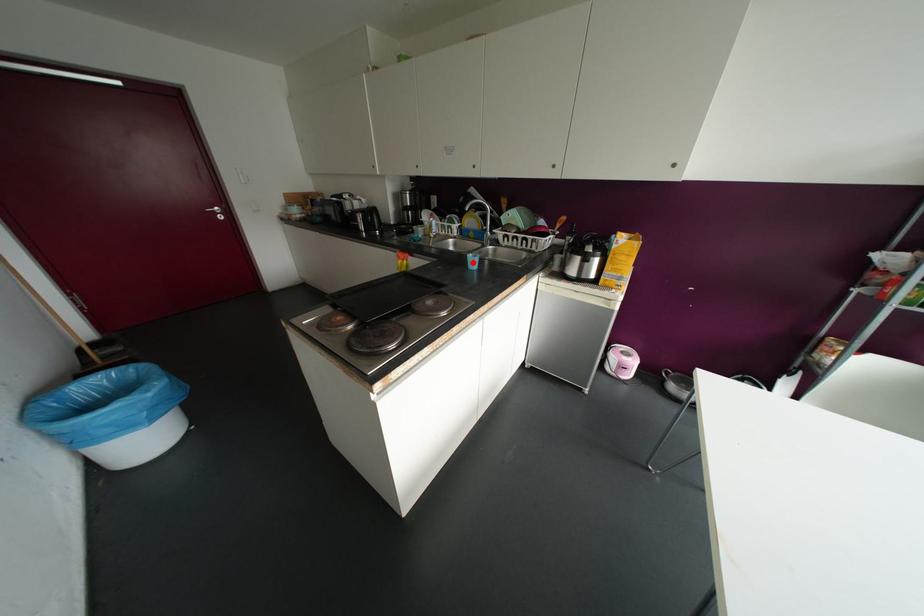
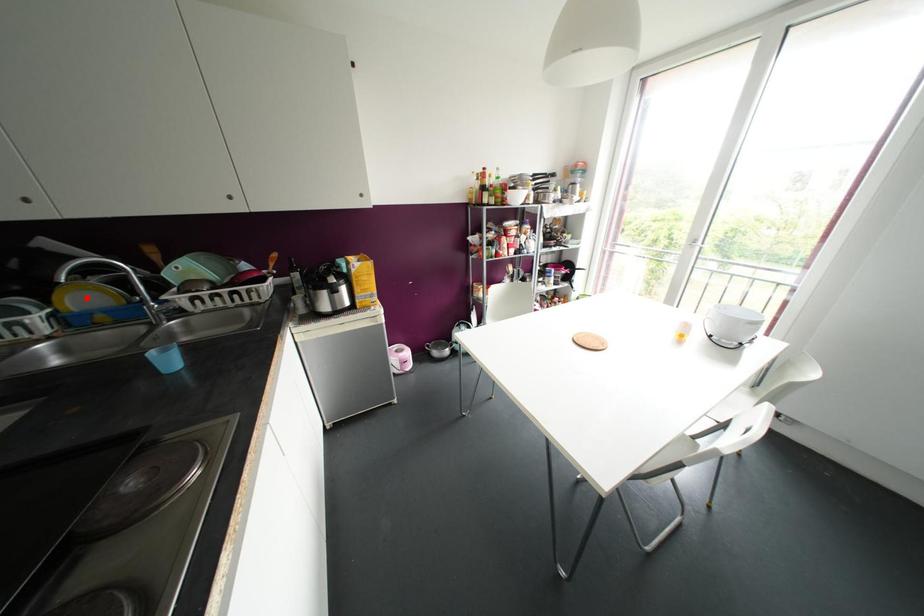
I am providing you with two images of the same scene from different viewpoints. A red point is marked on the first image and another point is marked on the second image. Is the red point in image1 aligned with the point shown in image2?

No